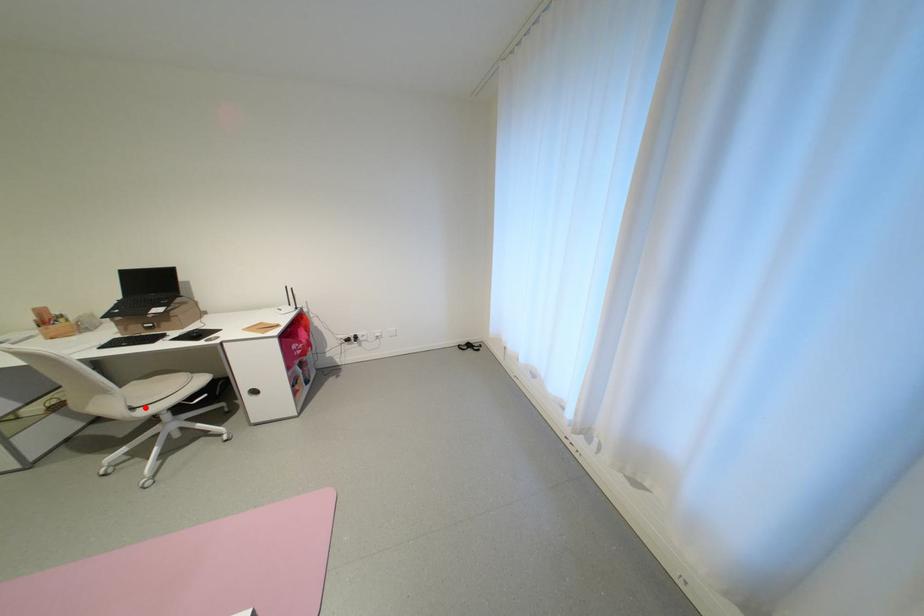
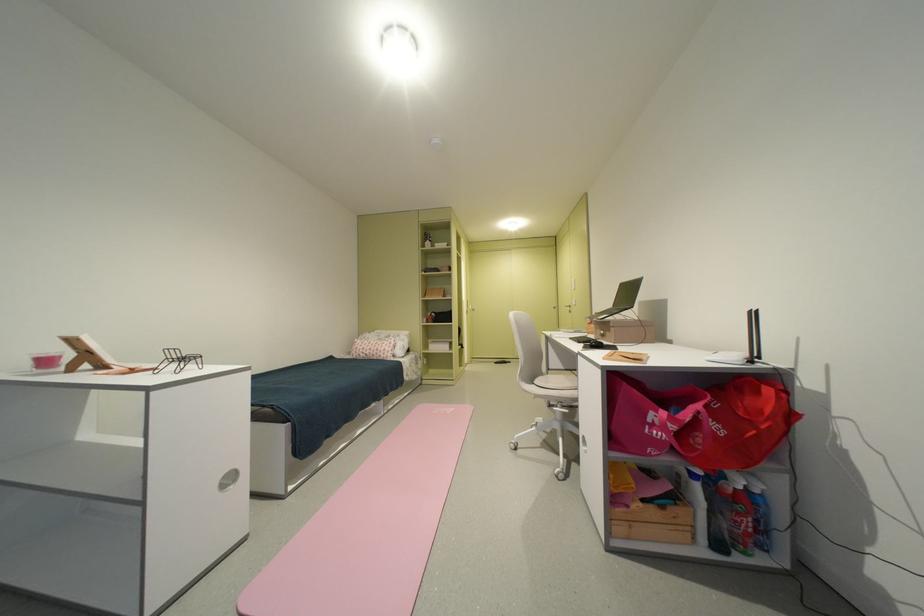
Find the pixel in the second image that matches the highlighted location in the first image.

(543, 383)